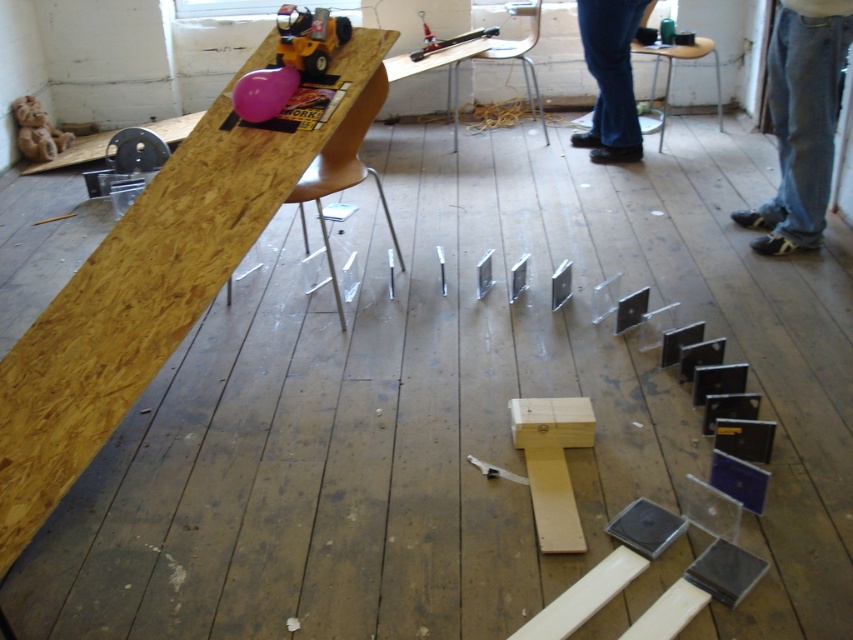
Question: Estimate the real-world distances between objects in this image. Which object is farther from the clear plastic ruler at upper center?

Choices:
 (A) yellow plastic toy truck at upper left
 (B) jeans at lower right
 (C) brown leather stool at upper center
 (D) wooden plank at upper left

Answer: (D)

Question: Does wooden plank at upper left appear over clear plastic ruler at upper center?

Choices:
 (A) no
 (B) yes

Answer: (A)

Question: Does jeans at lower right appear over yellow plastic toy truck at upper left?

Choices:
 (A) no
 (B) yes

Answer: (B)

Question: Does wooden plank at upper left appear on the right side of brown leather stool at upper center?

Choices:
 (A) yes
 (B) no

Answer: (B)

Question: Which point appears closest to the camera in this image?

Choices:
 (A) click(x=135, y=278)
 (B) click(x=622, y=154)

Answer: (A)

Question: Which object is the farthest from the jeans at lower right?

Choices:
 (A) blue jeans at right
 (B) brown leather stool at upper center
 (C) clear plastic ruler at upper center
 (D) wooden plank at upper left

Answer: (D)